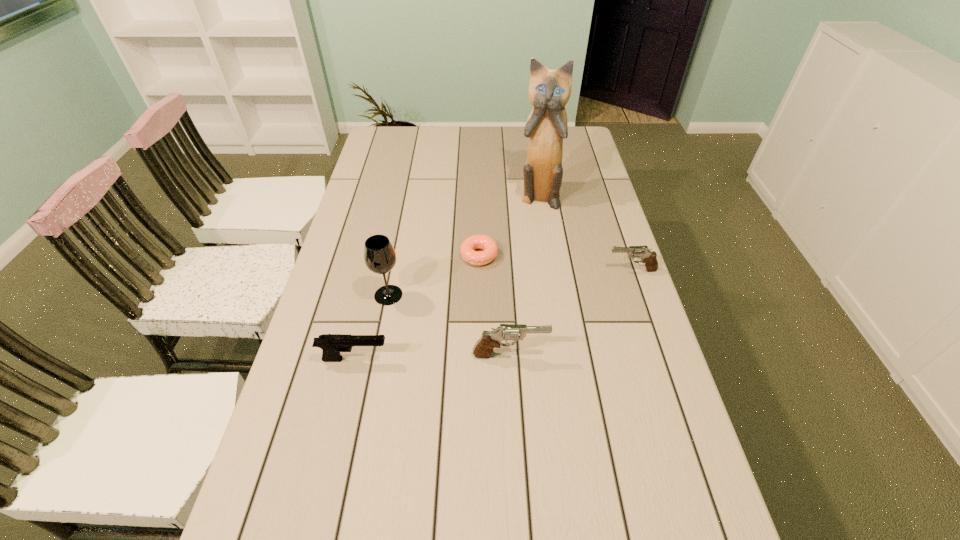
This screenshot has width=960, height=540. Find the location of `object located in the right edge section of the desktop`. object located in the right edge section of the desktop is located at coordinates (648, 257).

This screenshot has width=960, height=540. I want to click on free space at the far edge, so click(421, 136).

You are a GUI agent. You are given a task and a screenshot of the screen. Output one action in this format:
    pyautogui.click(x=<x>, y=<y>)
    Task: Click on the free spot at the near edge of the desktop
    
    Given the screenshot: What is the action you would take?
    pyautogui.click(x=406, y=516)

Where is `vacant region at the left edge of the desktop`? vacant region at the left edge of the desktop is located at coordinates (388, 230).

The image size is (960, 540). In order to click on vacant area at the right edge of the desktop in this screenshot , I will do `click(623, 450)`.

Where is `vacant space at the far right corner of the desktop`? The height and width of the screenshot is (540, 960). vacant space at the far right corner of the desktop is located at coordinates (584, 136).

What are the coordinates of `blank region between the tallest pistol and the tallest object` in the screenshot? It's located at (524, 275).

Locate an element on the screen. Image resolution: width=960 pixels, height=540 pixels. free spot between the tallest object and the rightmost pistol is located at coordinates (585, 233).

Locate an element on the screen. This screenshot has width=960, height=540. free spot between the leftmost pistol and the shortest object is located at coordinates point(417,307).

Locate an element on the screen. empty space between the wineglass and the second pistol from right to left is located at coordinates (449, 325).